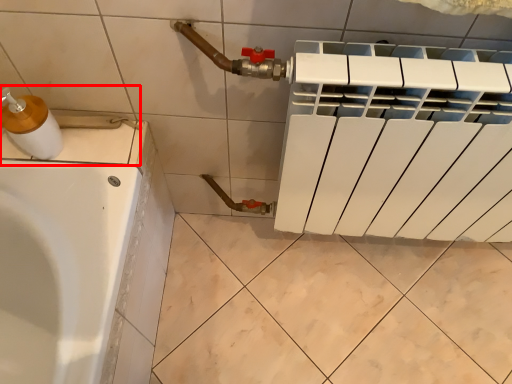
Question: From the image's perspective, what is the correct spatial positioning of sink (annotated by the red box) in reference to soap dispenser?

Choices:
 (A) below
 (B) above

Answer: (A)